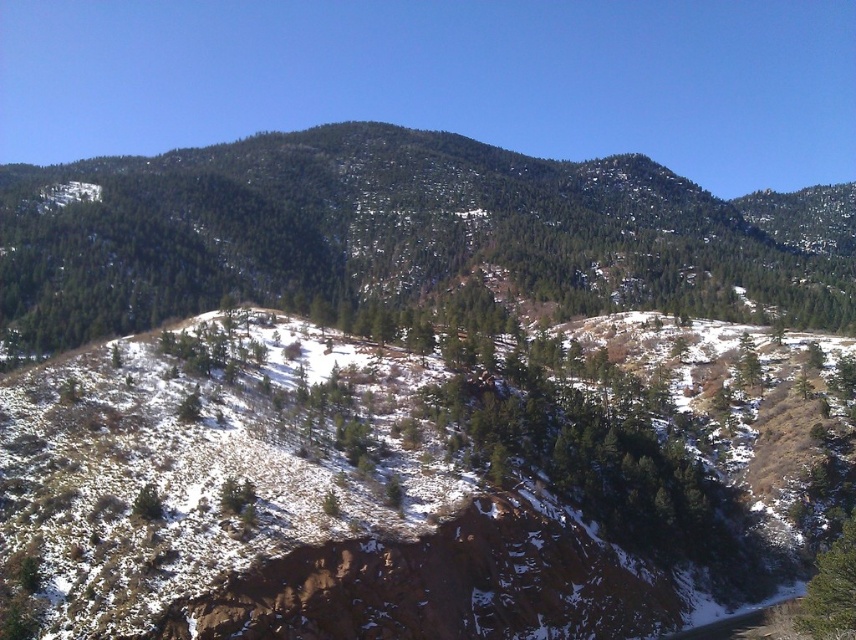
What do you see at coordinates (405, 236) in the screenshot? Image resolution: width=856 pixels, height=640 pixels. I see `green textured hillside at center` at bounding box center [405, 236].

Which is more to the left, green textured hillside at center or green matte tree at lower right?

green matte tree at lower right

Is point (640, 243) farther from camera compared to point (807, 618)?

That is True.

You are a GUI agent. You are given a task and a screenshot of the screen. Output one action in this format:
    pyautogui.click(x=<x>, y=<y>)
    Task: Click on the green textured hillside at center
    The image size is (856, 640).
    Given the screenshot: What is the action you would take?
    pyautogui.click(x=405, y=236)